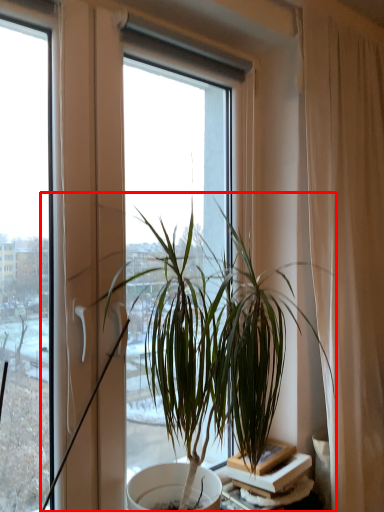
Question: From the image's perspective, what is the correct spatial positioning of houseplant (annotated by the red box) in reference to table?

Choices:
 (A) above
 (B) below

Answer: (A)